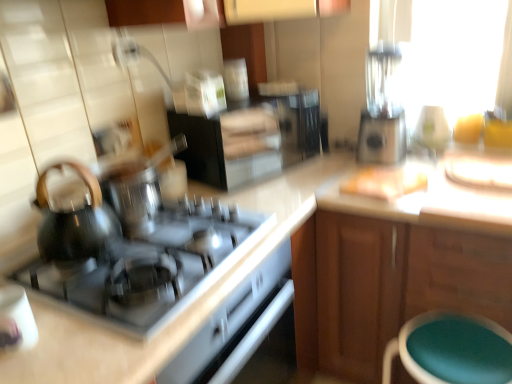
Where is `vacant space to the right of sleek silver blender at upper right`? The image size is (512, 384). vacant space to the right of sleek silver blender at upper right is located at coordinates (422, 161).